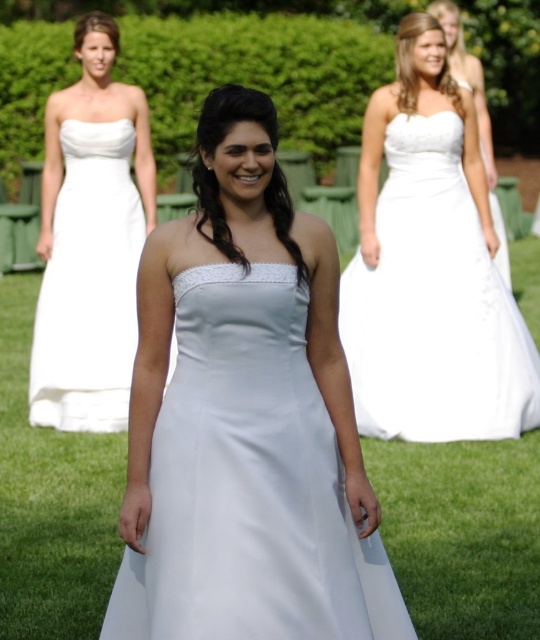
You are a photographer adjusting the focus of your camera. You need to ensure that both points, point(x=428, y=72) and point(x=57, y=324), are in focus. Given that your current focus plane can only sharply focus on objects at a single depth, which point should you prioritize focusing on to capture the most important subject?

Point(x=428, y=72) should be prioritized for focus because it is closer to the camera and likely represents the central figure in the foreground, who is the main subject of the image.

You are a photographer who wants to focus on the satin white dress at center. Where exactly should you adjust your camera focus to ensure the dress is sharp?

The satin white dress at center is located at point (248,484), so adjust your camera focus to that coordinate to ensure sharpness.

In the image of the wedding scene, there is a point located at coordinates (430, 268). What object is situated at this specific coordinate?

The point at coordinates (430, 268) indicates the white satin dress at upper center.